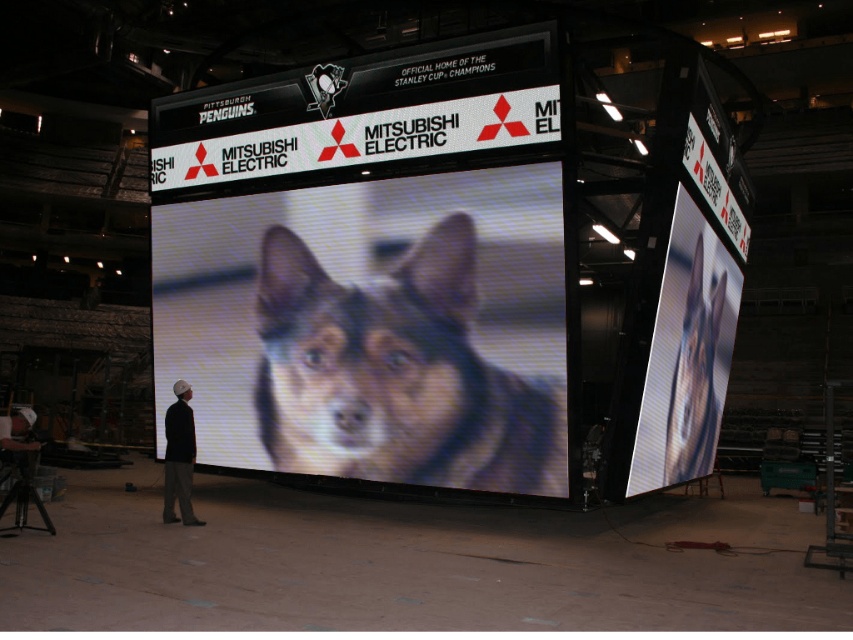
You are an engineer tasked with aligning a spotlight on the brown fur dog at center. The arena uses a coordinate system where the bottom left corner is the origin. The spotlight can only be placed at coordinates that are multiples of 0.1. What is the closest valid coordinate to the dog to ensure proper lighting?

The brown fur dog at center is located at point (392, 372). The closest valid coordinates to this point using multiples of 0.1 would be (426, 384). This ensures the spotlight is as close as possible to the dog while adhering to the arena system requirements.

You are an event planner setting up a promotional stand in the arena. You need to place a 1.5m tall mascot costume next to the brown fur dog at center and the shiny digital display at center. Based on their sizes, which object should the mascot be placed closer to?

The brown fur dog at center is taller than the shiny digital display at center. Therefore, the mascot costume should be placed closer to the shiny digital display at center to avoid blocking the view of the taller dog.